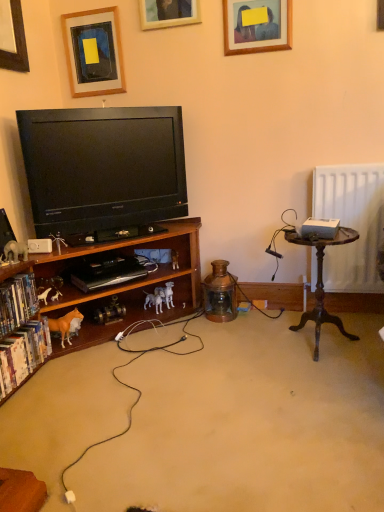
The height and width of the screenshot is (512, 384). What are the coordinates of `free space in front of brown matte horse at lower left` in the screenshot? It's located at 64,369.